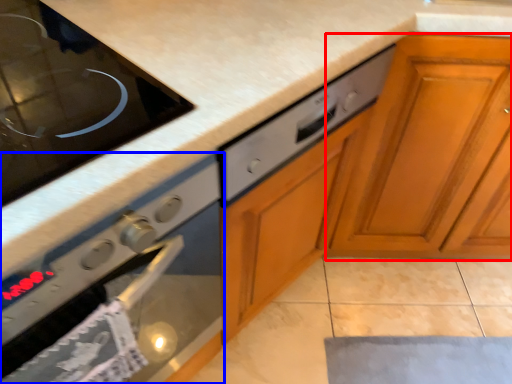
Question: Which point is closer to the camera, cabinetry (highlighted by a red box) or oven (highlighted by a blue box)?

Choices:
 (A) cabinetry
 (B) oven

Answer: (B)